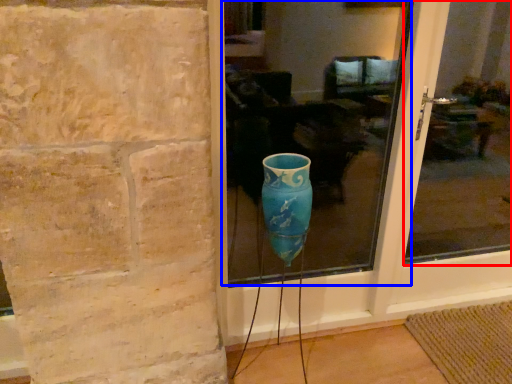
Question: Which object appears farthest to the camera in this image, glass window (highlighted by a red box) or glass window (highlighted by a blue box)?

Choices:
 (A) glass window
 (B) glass window

Answer: (A)